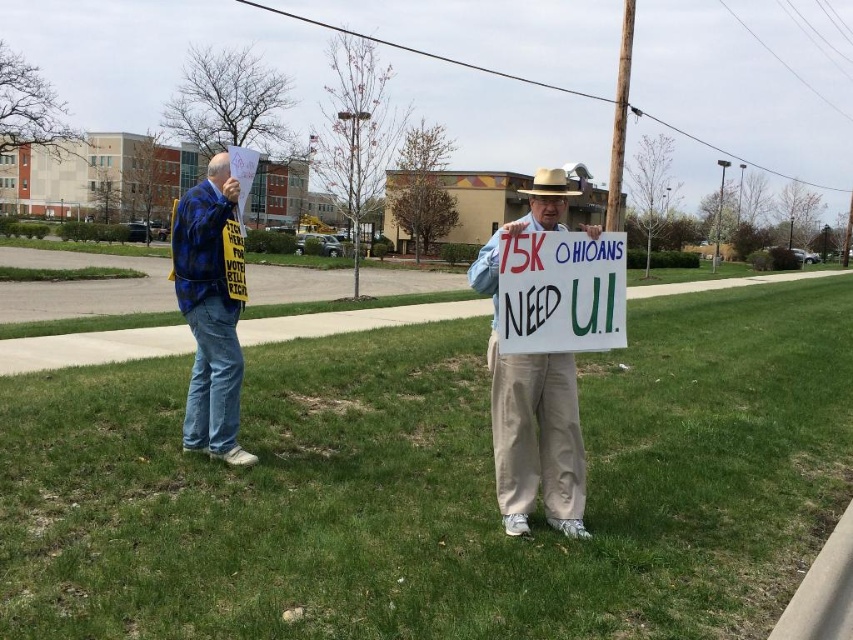
You are a photographer trying to capture the white paper sign at center in your shot. Based on the scene description, where should you position your camera to ensure the sign is centered in the frame?

The white paper sign at center is already located at the center of the image at coordinates point (532, 404), so positioning the camera to aim directly at this point will ensure the sign is centered in the frame.

You are a photographer trying to capture both the white paper sign at center and the brown felt cowboy hat at center in a single frame. Given that your camera can only focus on objects wider than 12 inches, will both objects fit within the frame?

The white paper sign at center is narrower than the brown felt cowboy hat at center. Since the camera requires objects wider than 12 inches, only the brown felt cowboy hat at center meets the width requirement. The white paper sign at center is too narrow to be focused on, so it won